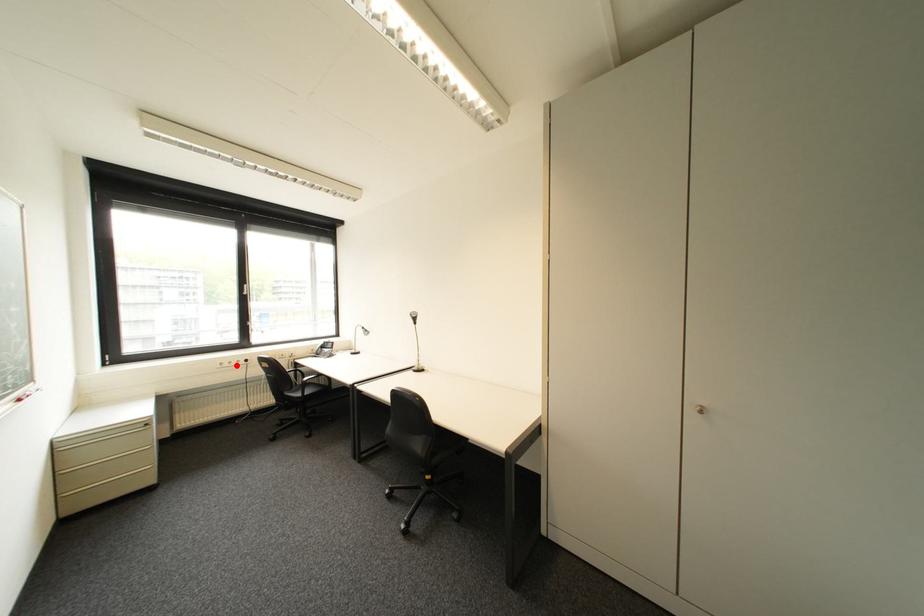
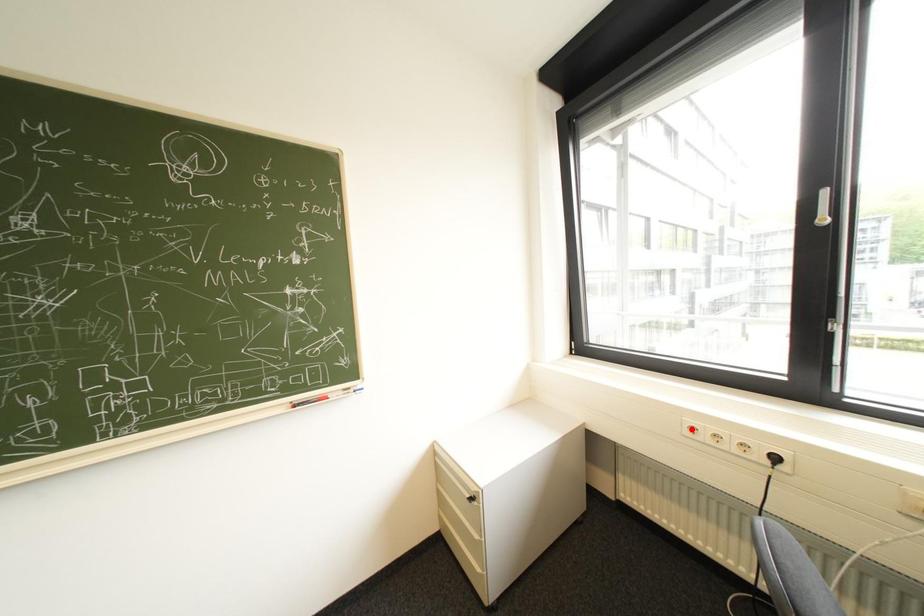
I am providing you with two images of the same scene from different viewpoints. A red point is marked on the first image and another point is marked on the second image. Do the highlighted points in image1 and image2 indicate the same real-world spot?

No